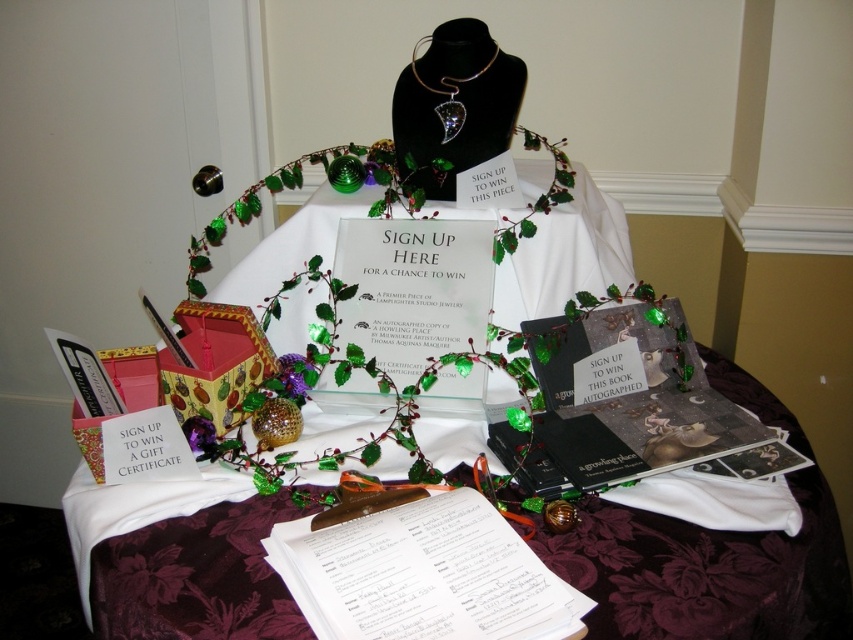
You are standing at the edge of the event area and want to sign up for the raffle. The necklace is displayed on a black mannequin bust, and the sign is at the center of the table. Considering the distance between you and the burgundy velvet tablecloth at lower center, can you comfortably reach the sign without moving closer?

The distance between you and the burgundy velvet tablecloth at lower center is 26.56 inches. Since this distance is within a comfortable reaching range, you can likely reach the sign at the center of the table without needing to move closer.

You are standing in front of the raffle table and notice two points marked on the table. The first point is at coordinates point [564,536] and the second is at point [437,81]. Which of these points is closer to you?

Point [564,536] is closer to the viewer than point [437,81].

You are standing at the event table and want to grab the necklace prize. The necklace is located at point (648, 516). If you can reach up to 80 centimeters, will you be able to reach it?

The distance between you and the necklace at point (648, 516) is 83.12 centimeters. Since your reach is only up to 80 centimeters, you cannot reach it.